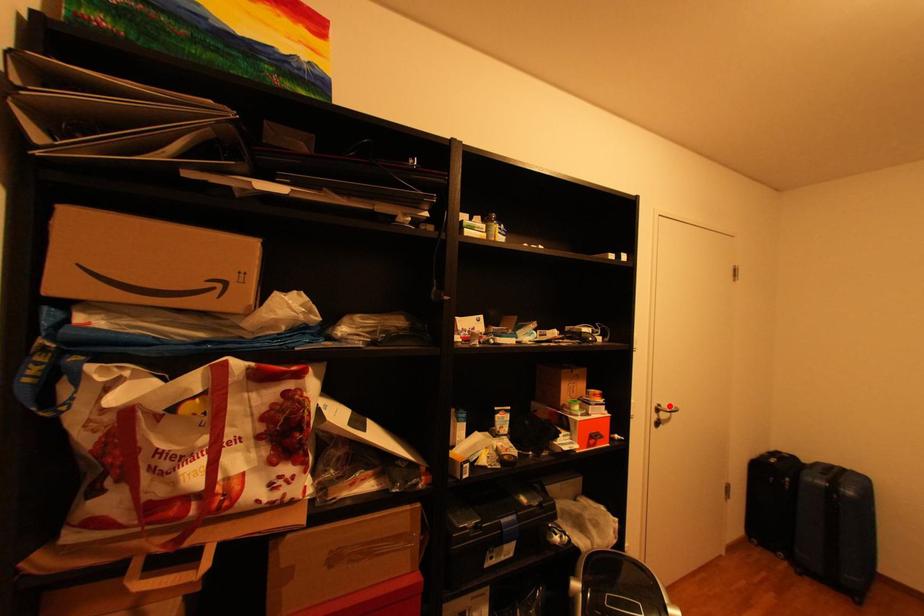
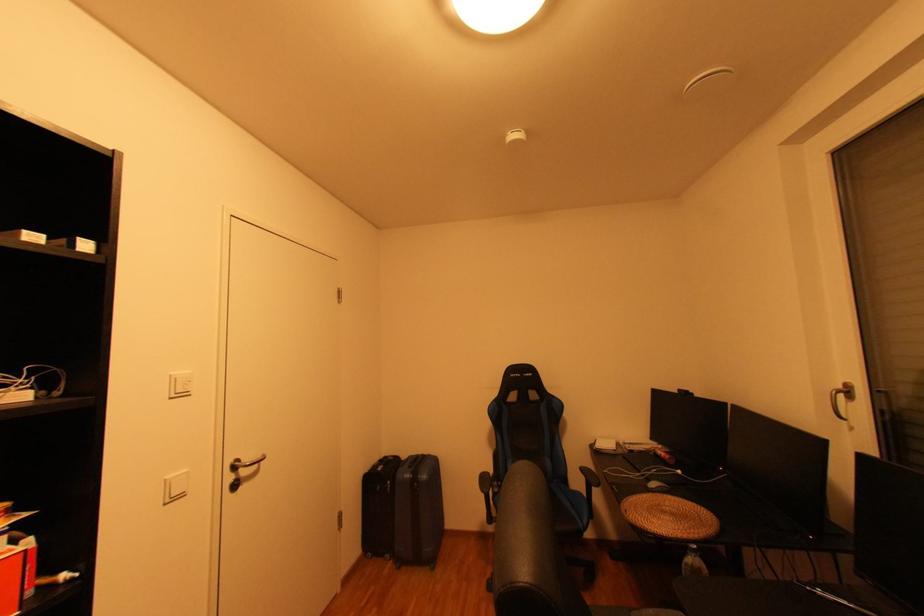
The point at the highlighted location is marked in the first image. Where is the corresponding point in the second image?

(247, 461)